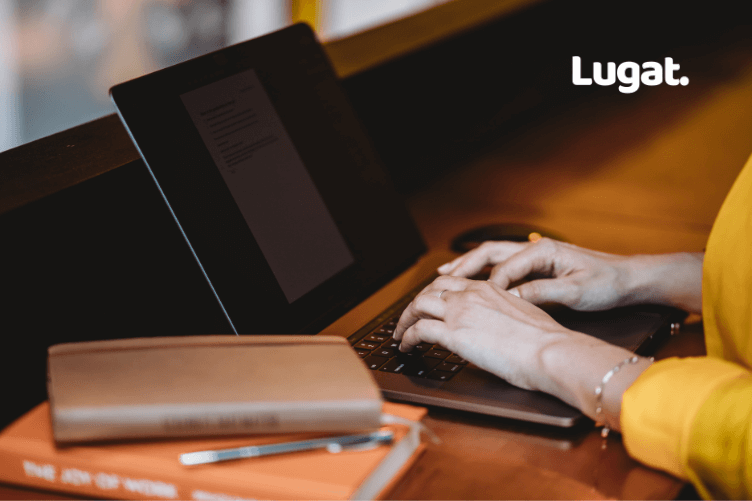
The height and width of the screenshot is (501, 752). I want to click on area above monitor, so click(185, 29).